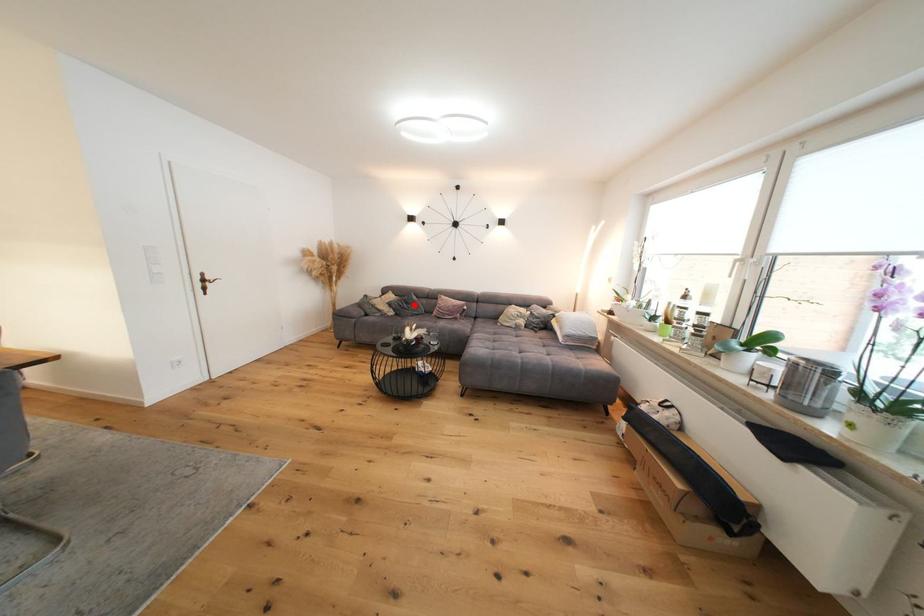
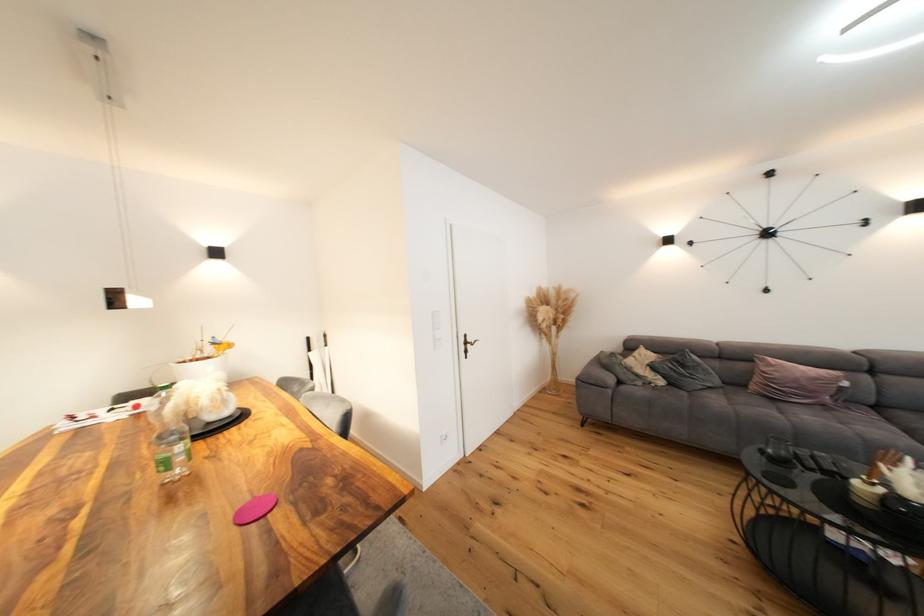
The point at the highlighted location is marked in the first image. Where is the corresponding point in the second image?

(690, 368)